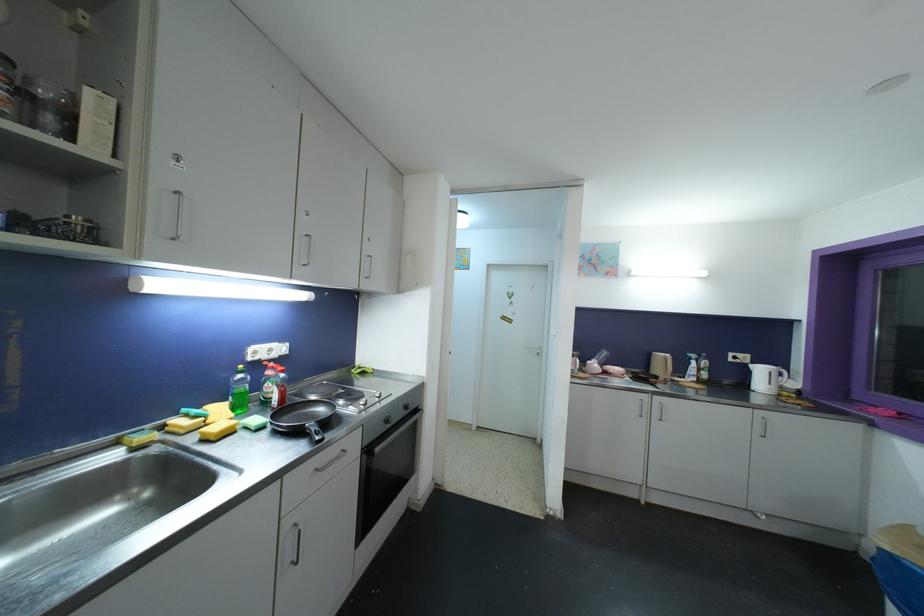
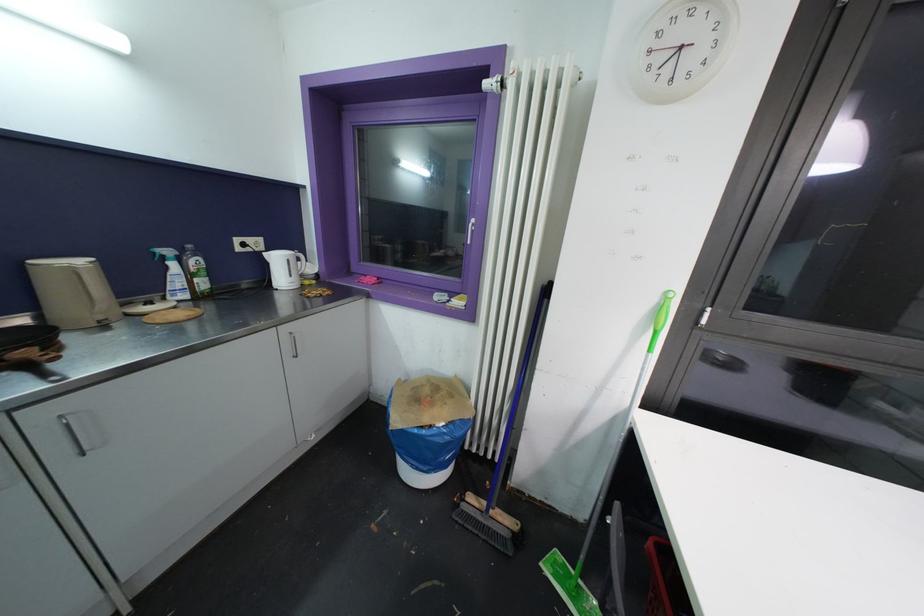
In the second image, find the point that corresponds to point (697, 365) in the first image.

(176, 267)